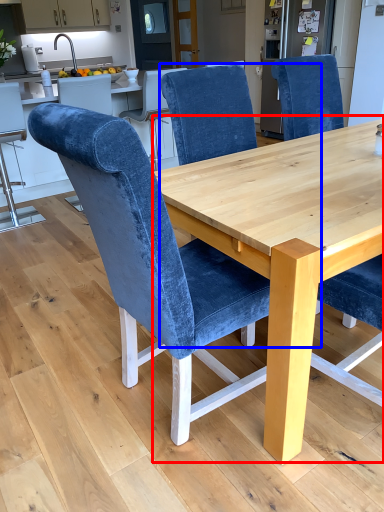
Question: Among these objects, which one is nearest to the camera, round table (highlighted by a red box) or chair (highlighted by a blue box)?

Choices:
 (A) round table
 (B) chair

Answer: (A)